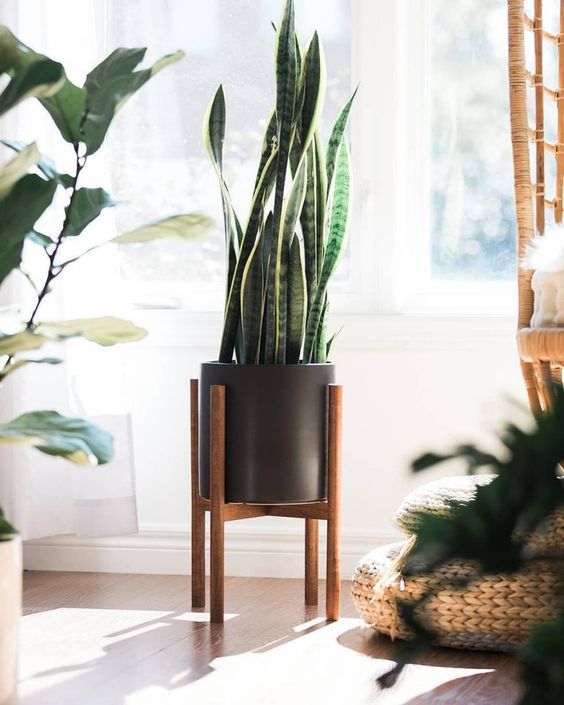
Where is `1 left side of a window`? 1 left side of a window is located at coordinates (167, 264).